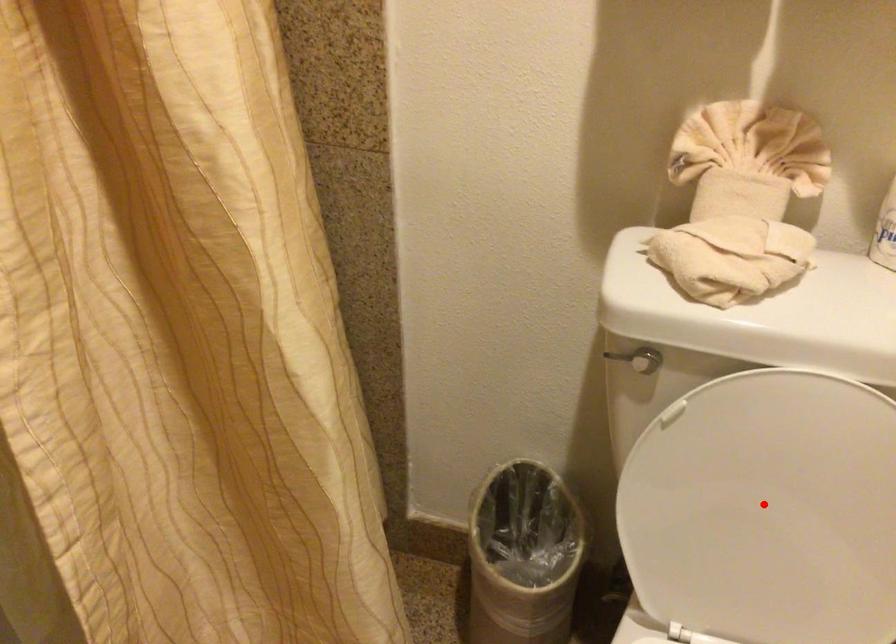
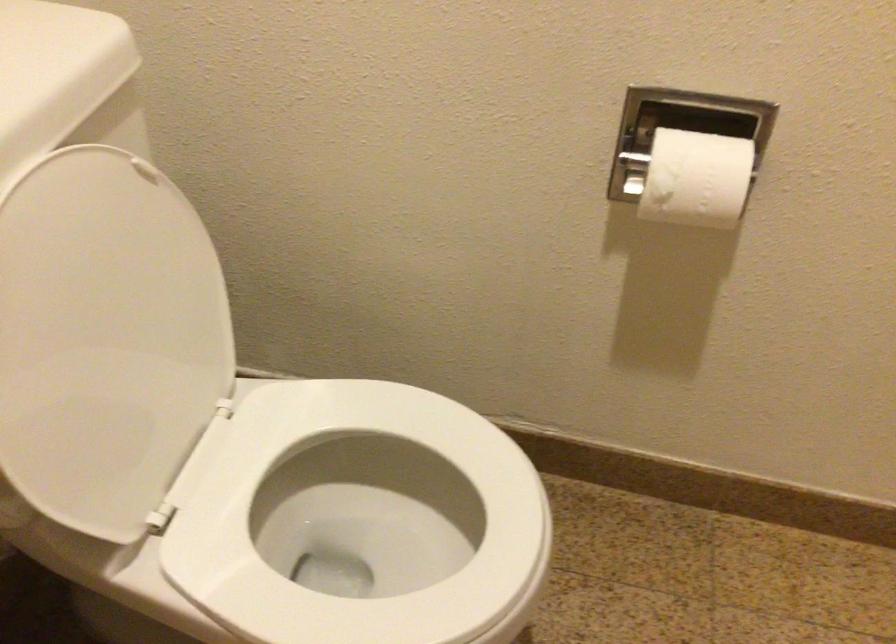
Question: A red point is marked in image1. In image2, is the corresponding 3D point closer to the camera or farther? Reply with the corresponding letter.

Choices:
 (A) The corresponding 3D point is closer.
 (B) The corresponding 3D point is farther.

Answer: (A)